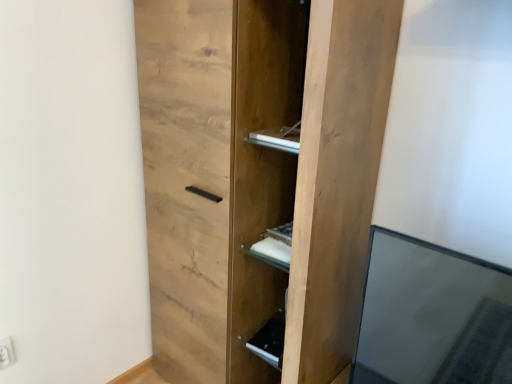
Question: Would you say natural wood cupboard at center is outside white plastic electric outlet at lower left?

Choices:
 (A) yes
 (B) no

Answer: (A)

Question: Is natural wood cupboard at center placed right next to white plastic electric outlet at lower left?

Choices:
 (A) no
 (B) yes

Answer: (A)

Question: From the image's perspective, is natural wood cupboard at center located above white plastic electric outlet at lower left?

Choices:
 (A) yes
 (B) no

Answer: (A)

Question: Are natural wood cupboard at center and white plastic electric outlet at lower left far apart?

Choices:
 (A) no
 (B) yes

Answer: (A)

Question: Considering the relative sizes of natural wood cupboard at center and white plastic electric outlet at lower left in the image provided, is natural wood cupboard at center taller than white plastic electric outlet at lower left?

Choices:
 (A) no
 (B) yes

Answer: (B)

Question: Would you say white plastic electric outlet at lower left is to the left or to the right of matte wood cabinet at lower center in the picture?

Choices:
 (A) left
 (B) right

Answer: (A)

Question: In terms of width, does white plastic electric outlet at lower left look wider or thinner when compared to matte wood cabinet at lower center?

Choices:
 (A) wide
 (B) thin

Answer: (B)

Question: From a real-world perspective, relative to matte wood cabinet at lower center, is white plastic electric outlet at lower left vertically above or below?

Choices:
 (A) above
 (B) below

Answer: (B)

Question: Is point (8, 365) positioned closer to the camera than point (281, 314)?

Choices:
 (A) closer
 (B) farther

Answer: (A)

Question: From the image's perspective, is natural wood cupboard at center above or below white plastic electric outlet at lower left?

Choices:
 (A) above
 (B) below

Answer: (A)

Question: Considering the positions of natural wood cupboard at center and white plastic electric outlet at lower left in the image, is natural wood cupboard at center bigger or smaller than white plastic electric outlet at lower left?

Choices:
 (A) big
 (B) small

Answer: (A)

Question: Is natural wood cupboard at center in front of or behind white plastic electric outlet at lower left in the image?

Choices:
 (A) front
 (B) behind

Answer: (A)

Question: Is natural wood cupboard at center inside or outside of white plastic electric outlet at lower left?

Choices:
 (A) inside
 (B) outside

Answer: (B)

Question: In terms of size, does natural wood cupboard at center appear bigger or smaller than matte wood cabinet at lower center?

Choices:
 (A) small
 (B) big

Answer: (B)

Question: In the image, is natural wood cupboard at center positioned in front of or behind matte wood cabinet at lower center?

Choices:
 (A) behind
 (B) front

Answer: (B)